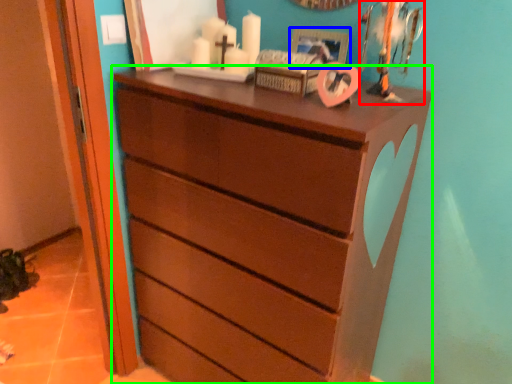
Question: Which object is positioned farthest from toy (highlighted by a red box)? Select from picture frame (highlighted by a blue box) and chest of drawers (highlighted by a green box).

Choices:
 (A) picture frame
 (B) chest of drawers

Answer: (B)